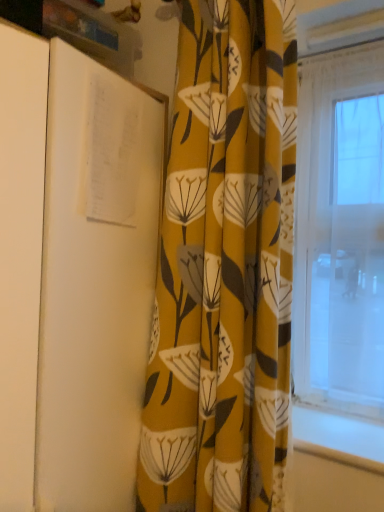
Question: Do you think yellow floral fabric curtain at center is within white paper at left, or outside of it?

Choices:
 (A) inside
 (B) outside

Answer: (B)

Question: Considering the positions of yellow floral fabric curtain at center and white paper at left in the image, is yellow floral fabric curtain at center taller or shorter than white paper at left?

Choices:
 (A) tall
 (B) short

Answer: (A)

Question: From the image's perspective, is yellow floral fabric curtain at center positioned above or below white paper at left?

Choices:
 (A) below
 (B) above

Answer: (B)

Question: Looking at their shapes, would you say white paper at left is wider or thinner than yellow floral fabric curtain at center?

Choices:
 (A) thin
 (B) wide

Answer: (B)

Question: Based on their positions, is white paper at left located to the left or right of yellow floral fabric curtain at center?

Choices:
 (A) left
 (B) right

Answer: (A)

Question: In the image, is white paper at left positioned in front of or behind yellow floral fabric curtain at center?

Choices:
 (A) behind
 (B) front

Answer: (B)

Question: In terms of height, does white paper at left look taller or shorter compared to yellow floral fabric curtain at center?

Choices:
 (A) tall
 (B) short

Answer: (B)